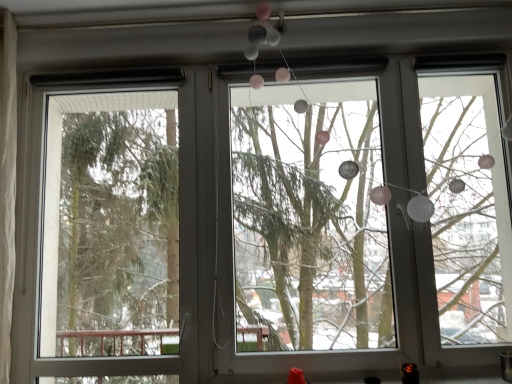
This screenshot has width=512, height=384. I want to click on transparent glass screen door at left, so click(x=111, y=226).

Based on the photo, in order to face transparent glass screen door at left, should I rotate leftwards or rightwards?

Turn left approximately 19.547 degrees to face it.

What do you see at coordinates (111, 226) in the screenshot? This screenshot has height=384, width=512. I see `transparent glass screen door at left` at bounding box center [111, 226].

Describe the element at coordinates (372, 218) in the screenshot. The width and height of the screenshot is (512, 384). I see `matte white garland at center` at that location.

Locate an element on the screen. matte white garland at center is located at coordinates (372, 218).

You are a GUI agent. You are given a task and a screenshot of the screen. Output one action in this format:
    pyautogui.click(x=<x>, y=<y>)
    Task: Click on the transparent glass screen door at left
    This screenshot has height=384, width=512.
    Given the screenshot: What is the action you would take?
    pyautogui.click(x=111, y=226)

Considering the positions of objects matte white garland at center and transparent glass screen door at left in the image provided, who is more to the left, matte white garland at center or transparent glass screen door at left?

transparent glass screen door at left.

Is matte white garland at center positioned behind transparent glass screen door at left?

No, the depth of matte white garland at center is less than that of transparent glass screen door at left.

Considering the positions of point (407, 100) and point (66, 108), is point (407, 100) closer or farther from the camera than point (66, 108)?

Point (407, 100).

From the image's perspective, is matte white garland at center located beneath transparent glass screen door at left?

No.

From a real-world perspective, is matte white garland at center physically above transparent glass screen door at left?

Yes, from a real-world perspective, matte white garland at center is on top of transparent glass screen door at left.

Can you confirm if matte white garland at center is wider than transparent glass screen door at left?

Yes.

Does matte white garland at center have a greater height compared to transparent glass screen door at left?

Indeed, matte white garland at center has a greater height compared to transparent glass screen door at left.

Considering the sizes of objects matte white garland at center and transparent glass screen door at left in the image provided, who is smaller, matte white garland at center or transparent glass screen door at left?

transparent glass screen door at left is smaller.

Is matte white garland at center outside of transparent glass screen door at left?

Absolutely, matte white garland at center is external to transparent glass screen door at left.

In the scene shown: Is matte white garland at center touching transparent glass screen door at left?

No, matte white garland at center is not next to transparent glass screen door at left.

Could you tell me if matte white garland at center is turned towards transparent glass screen door at left?

No, matte white garland at center is not aimed at transparent glass screen door at left.

Consider the image. Can you tell me how much matte white garland at center and transparent glass screen door at left differ in facing direction?

0.0877 degrees.

How much distance is there between matte white garland at center and transparent glass screen door at left?

matte white garland at center is 7.02 feet away from transparent glass screen door at left.

This screenshot has width=512, height=384. In order to click on bay window in front of the transparent glass screen door at left in this screenshot , I will do `click(372, 218)`.

Is transparent glass screen door at left to the right of matte white garland at center from the viewer's perspective?

Incorrect, transparent glass screen door at left is not on the right side of matte white garland at center.

Which is in front, transparent glass screen door at left or matte white garland at center?

matte white garland at center.

Is point (50, 169) farther from viewer compared to point (260, 300)?

No, (50, 169) is in front of (260, 300).

From the image's perspective, which one is positioned lower, transparent glass screen door at left or matte white garland at center?

transparent glass screen door at left, from the image's perspective.

From a real-world perspective, is transparent glass screen door at left positioned above or below matte white garland at center?

transparent glass screen door at left is situated lower than matte white garland at center in the real world.

Can you confirm if transparent glass screen door at left is thinner than matte white garland at center?

Yes.

In terms of height, does transparent glass screen door at left look taller or shorter compared to matte white garland at center?

transparent glass screen door at left is shorter than matte white garland at center.

Does transparent glass screen door at left have a smaller size compared to matte white garland at center?

Correct, transparent glass screen door at left occupies less space than matte white garland at center.

Is matte white garland at center inside transparent glass screen door at left?

No, matte white garland at center is not inside transparent glass screen door at left.

Is the surface of transparent glass screen door at left in direct contact with matte white garland at center?

There is a gap between transparent glass screen door at left and matte white garland at center.

Is transparent glass screen door at left turned away from matte white garland at center?

No, matte white garland at center is not at the back of transparent glass screen door at left.

Locate an element on the screen. This screenshot has width=512, height=384. screen door behind the matte white garland at center is located at coordinates (111, 226).

The image size is (512, 384). Identify the location of screen door behind the matte white garland at center. (111, 226).

The width and height of the screenshot is (512, 384). Find the location of `bay window lying on the right of transparent glass screen door at left`. bay window lying on the right of transparent glass screen door at left is located at coordinates (372, 218).